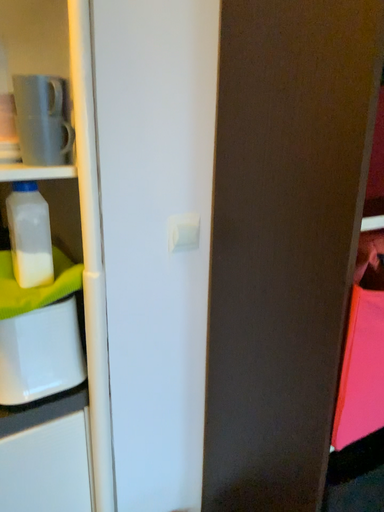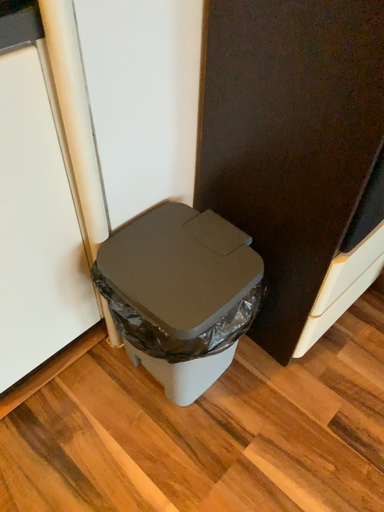
Question: Which way did the camera rotate in the video?

Choices:
 (A) rotated left
 (B) rotated right

Answer: (B)